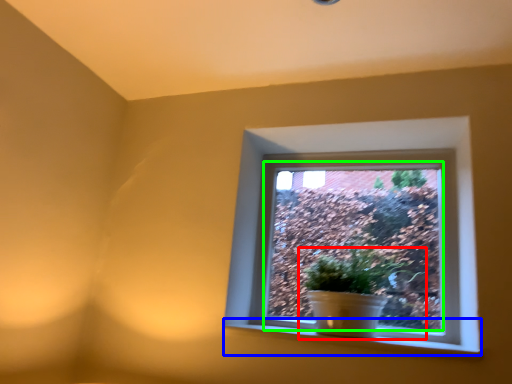
Question: Considering the real-world distances, which object is farthest from houseplant (highlighted by a red box)? window sill (highlighted by a blue box) or window screen (highlighted by a green box)?

Choices:
 (A) window sill
 (B) window screen

Answer: (A)